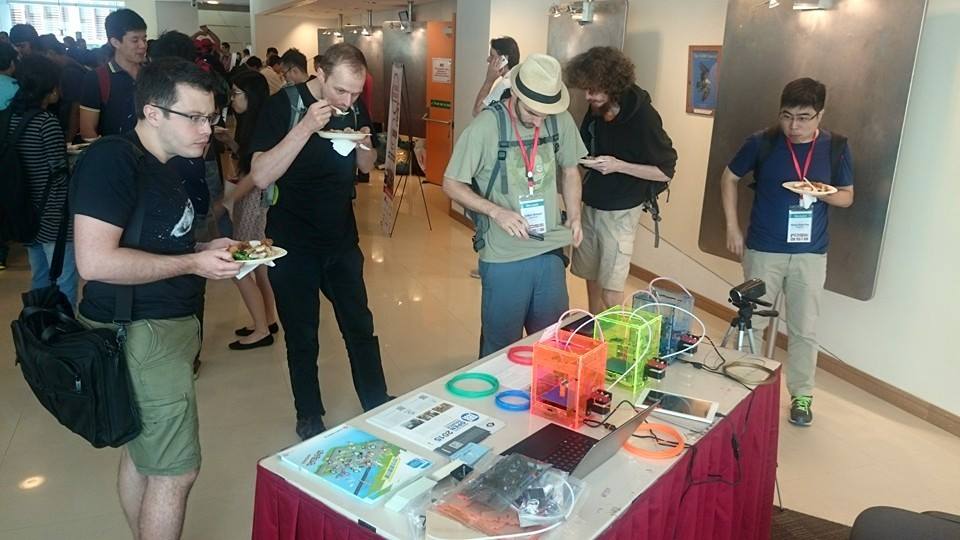
Locate an element on the screen. This screenshot has width=960, height=540. laptop is located at coordinates (572, 447).